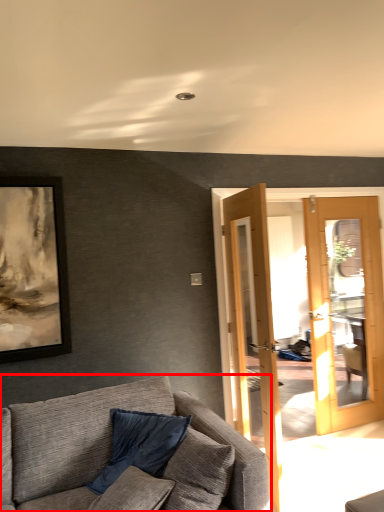
Question: From the image's perspective, what is the correct spatial positioning of studio couch (annotated by the red box) in reference to pillow?

Choices:
 (A) below
 (B) above

Answer: (A)